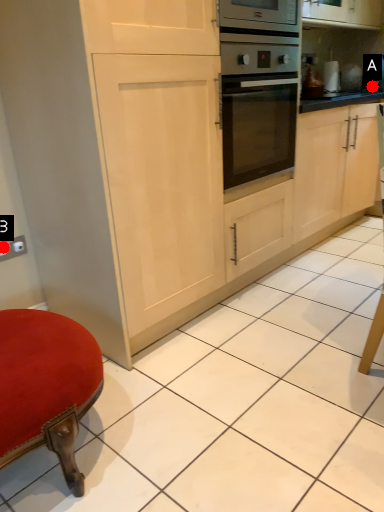
Question: Two points are circled on the image, labeled by A and B beside each circle. Among these points, which one is farthest from the camera?

Choices:
 (A) A is further
 (B) B is further

Answer: (A)